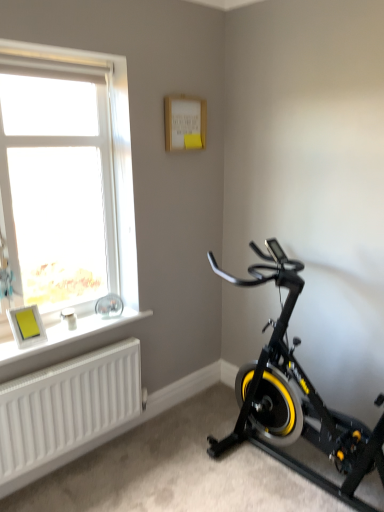
Locate an element on the screen. vacant location below white matte radiator at lower left (from a real-world perspective) is located at coordinates (95, 454).